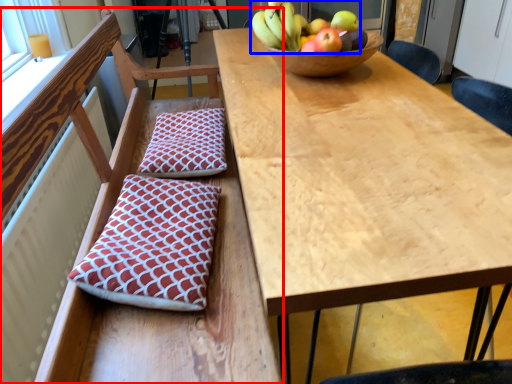
Question: Which of the following is the farthest to the observer, chair (highlighted by a red box) or banana (highlighted by a blue box)?

Choices:
 (A) chair
 (B) banana

Answer: (B)